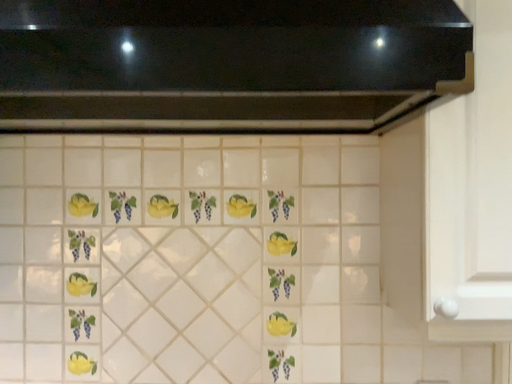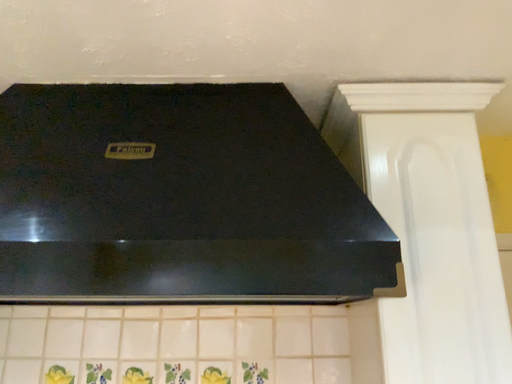
Question: Which way did the camera rotate in the video?

Choices:
 (A) rotated upward
 (B) rotated downward

Answer: (A)